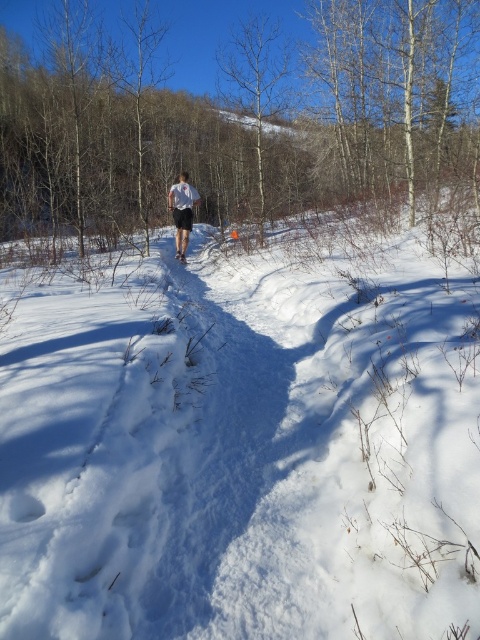
Question: Among these points, which one is farthest from the camera?

Choices:
 (A) (168, 198)
 (B) (100, 296)

Answer: (A)

Question: Does white fluffy snow at center come behind white matte shorts at center?

Choices:
 (A) no
 (B) yes

Answer: (A)

Question: Which object appears closest to the camera in this image?

Choices:
 (A) white fluffy snow at center
 (B) white matte shorts at center

Answer: (A)

Question: Can you confirm if white fluffy snow at center is positioned below white matte shorts at center?

Choices:
 (A) no
 (B) yes

Answer: (B)

Question: Can you confirm if white fluffy snow at center is positioned below white matte shorts at center?

Choices:
 (A) no
 (B) yes

Answer: (B)